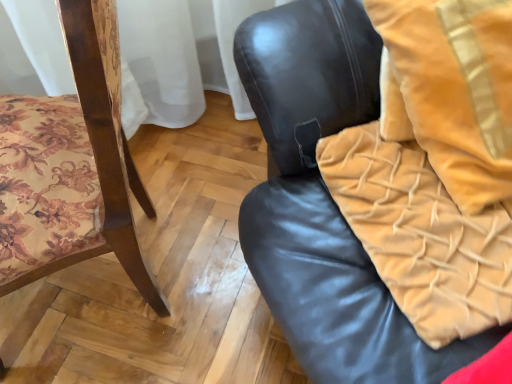
Question: Can you confirm if velvet yellow blanket at right is wider than black leather chair at center, the second chair from the left?

Choices:
 (A) yes
 (B) no

Answer: (A)

Question: From the image's perspective, does velvet yellow blanket at right appear higher than black leather chair at center, the second chair from the left?

Choices:
 (A) yes
 (B) no

Answer: (B)

Question: Is velvet yellow blanket at right aimed at black leather chair at center, the second chair from the left?

Choices:
 (A) no
 (B) yes

Answer: (B)

Question: Does velvet yellow blanket at right have a lesser height compared to black leather chair at center, the second chair from the left?

Choices:
 (A) no
 (B) yes

Answer: (B)

Question: Is black leather chair at center, the second chair from the left, a part of velvet yellow blanket at right?

Choices:
 (A) no
 (B) yes

Answer: (A)

Question: Based on their sizes in the image, would you say velvet gold throw pillow at upper right is bigger or smaller than black leather chair at center, the first chair positioned from the right?

Choices:
 (A) big
 (B) small

Answer: (B)

Question: In terms of width, does velvet gold throw pillow at upper right look wider or thinner when compared to black leather chair at center, the second chair from the left?

Choices:
 (A) wide
 (B) thin

Answer: (B)

Question: Is velvet gold throw pillow at upper right inside the boundaries of black leather chair at center, the first chair positioned from the right, or outside?

Choices:
 (A) inside
 (B) outside

Answer: (B)

Question: Is point tap(475, 52) closer or farther from the camera than point tap(408, 357)?

Choices:
 (A) closer
 (B) farther

Answer: (B)

Question: Considering the positions of wooden floral-patterned chair at left, placed as the 2th chair when sorted from right to left, and black leather chair at center, the first chair positioned from the right, in the image, is wooden floral-patterned chair at left, placed as the 2th chair when sorted from right to left, bigger or smaller than black leather chair at center, the first chair positioned from the right,?

Choices:
 (A) big
 (B) small

Answer: (A)

Question: Considering their positions, is wooden floral-patterned chair at left, placed as the 2th chair when sorted from right to left, located in front of or behind black leather chair at center, the second chair from the left?

Choices:
 (A) front
 (B) behind

Answer: (B)

Question: From the image's perspective, is wooden floral-patterned chair at left, placed as the 1th chair when sorted from left to right, above or below black leather chair at center, the first chair positioned from the right?

Choices:
 (A) below
 (B) above

Answer: (A)

Question: Would you say wooden floral-patterned chair at left, placed as the 1th chair when sorted from left to right, is inside or outside black leather chair at center, the second chair from the left?

Choices:
 (A) inside
 (B) outside

Answer: (B)

Question: Choose the correct answer: Is black leather chair at center, the first chair positioned from the right, inside velvet yellow blanket at right or outside it?

Choices:
 (A) inside
 (B) outside

Answer: (B)

Question: Is point (244, 72) positioned closer to the camera than point (338, 183)?

Choices:
 (A) closer
 (B) farther

Answer: (B)